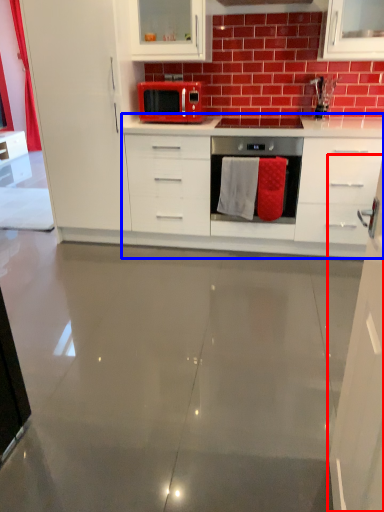
Question: Which object appears closest to the camera in this image, cabinetry (highlighted by a red box) or countertop (highlighted by a blue box)?

Choices:
 (A) cabinetry
 (B) countertop

Answer: (A)